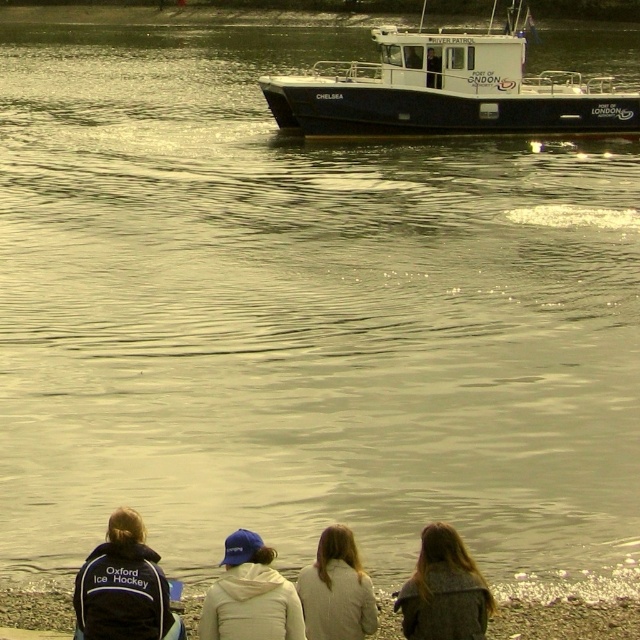
Describe the element at coordinates (124, 588) in the screenshot. This screenshot has width=640, height=640. I see `dark blue jacket at lower left` at that location.

Describe the element at coordinates (124, 588) in the screenshot. This screenshot has width=640, height=640. I see `dark blue jacket at lower left` at that location.

Where is `dark blue jacket at lower left`? Image resolution: width=640 pixels, height=640 pixels. dark blue jacket at lower left is located at coordinates (124, 588).

Which is above, white fleece jacket at lower center or light gray sweater at center?

white fleece jacket at lower center is above.

Is white fleece jacket at lower center above light gray sweater at center?

Yes.

Which is behind, point (225, 628) or point (328, 600)?

The point (328, 600) is behind.

I want to click on white fleece jacket at lower center, so pos(250,595).

Can you confirm if white fleece jacket at lower center is bigger than gray wool coat at lower right?

No, white fleece jacket at lower center is not bigger than gray wool coat at lower right.

Does white fleece jacket at lower center have a greater height compared to gray wool coat at lower right?

No, white fleece jacket at lower center is not taller than gray wool coat at lower right.

I want to click on white fleece jacket at lower center, so click(x=250, y=595).